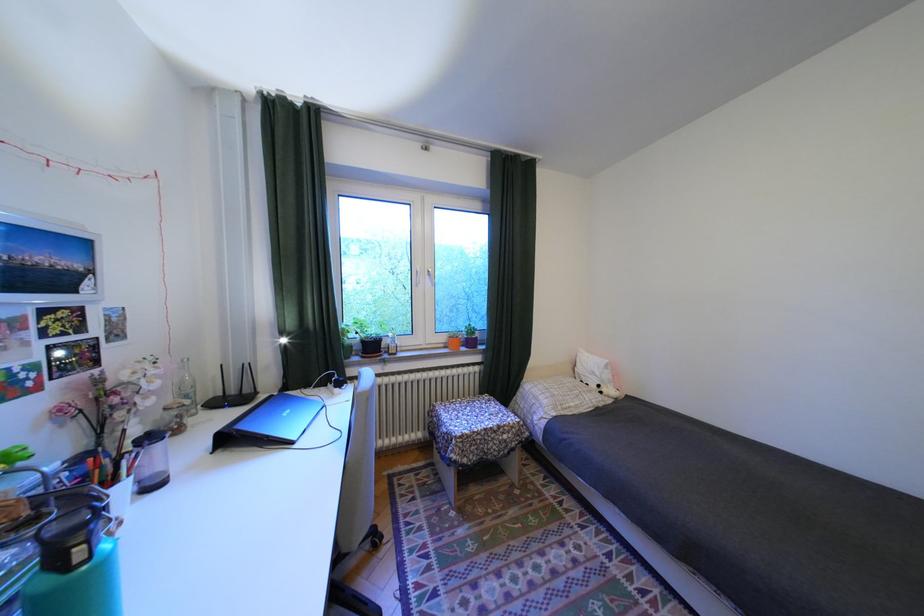
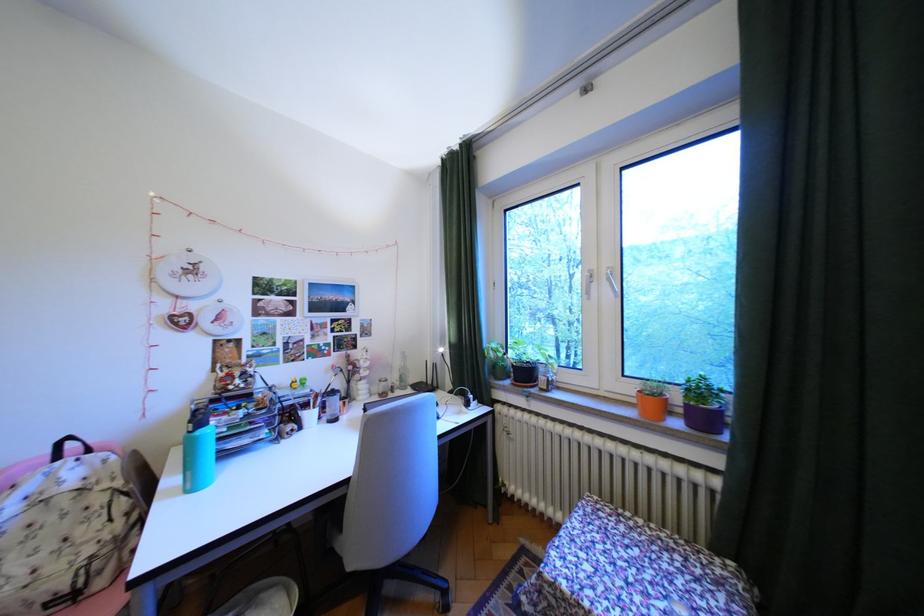
In the second image, find the point that corresponds to (x=455, y=339) in the first image.

(641, 390)